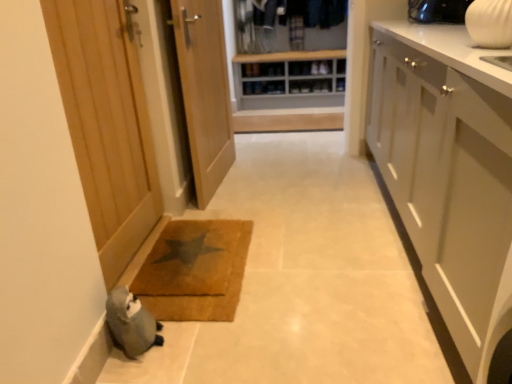
Question: Are wooden shoe rack at center and braided brown mat at lower center making contact?

Choices:
 (A) no
 (B) yes

Answer: (A)

Question: Considering the relative sizes of wooden shoe rack at center and braided brown mat at lower center in the image provided, is wooden shoe rack at center wider than braided brown mat at lower center?

Choices:
 (A) yes
 (B) no

Answer: (A)

Question: Does wooden shoe rack at center have a greater height compared to braided brown mat at lower center?

Choices:
 (A) no
 (B) yes

Answer: (B)

Question: Considering the relative sizes of wooden shoe rack at center and braided brown mat at lower center in the image provided, is wooden shoe rack at center bigger than braided brown mat at lower center?

Choices:
 (A) no
 (B) yes

Answer: (B)

Question: From a real-world perspective, is wooden shoe rack at center under braided brown mat at lower center?

Choices:
 (A) yes
 (B) no

Answer: (B)

Question: Is braided brown mat at lower center inside the boundaries of gray knitted stuffed animal at lower left, or outside?

Choices:
 (A) inside
 (B) outside

Answer: (B)

Question: Is braided brown mat at lower center in front of or behind gray knitted stuffed animal at lower left in the image?

Choices:
 (A) front
 (B) behind

Answer: (B)

Question: From the image's perspective, is braided brown mat at lower center located above or below gray knitted stuffed animal at lower left?

Choices:
 (A) above
 (B) below

Answer: (A)

Question: Would you say braided brown mat at lower center is to the left or to the right of gray knitted stuffed animal at lower left in the picture?

Choices:
 (A) left
 (B) right

Answer: (B)

Question: From the image's perspective, is wooden door at center, marked as the second door in a left-to-right arrangement, positioned above or below braided brown mat at lower center?

Choices:
 (A) above
 (B) below

Answer: (A)

Question: In the image, is wooden door at center, which is counted as the first door, starting from the right, positioned in front of or behind braided brown mat at lower center?

Choices:
 (A) behind
 (B) front

Answer: (A)

Question: Is wooden door at center, which is counted as the first door, starting from the right, inside the boundaries of braided brown mat at lower center, or outside?

Choices:
 (A) outside
 (B) inside

Answer: (A)

Question: Looking at their shapes, would you say wooden door at center, marked as the second door in a left-to-right arrangement, is wider or thinner than braided brown mat at lower center?

Choices:
 (A) wide
 (B) thin

Answer: (B)

Question: In terms of width, does braided brown mat at lower center look wider or thinner when compared to wooden door at center, marked as the second door in a left-to-right arrangement?

Choices:
 (A) wide
 (B) thin

Answer: (A)

Question: Considering their positions, is braided brown mat at lower center located in front of or behind wooden door at center, which is counted as the first door, starting from the right?

Choices:
 (A) behind
 (B) front

Answer: (B)